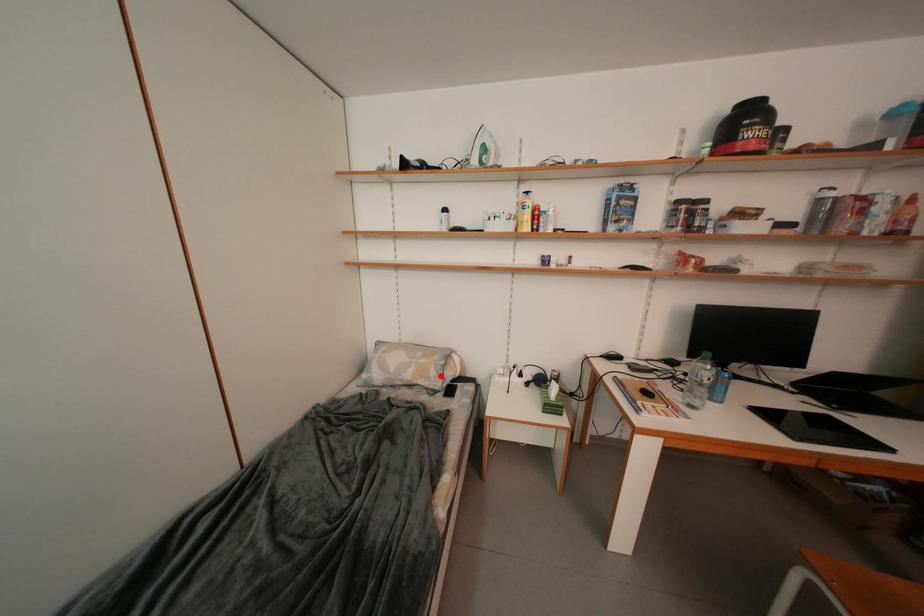
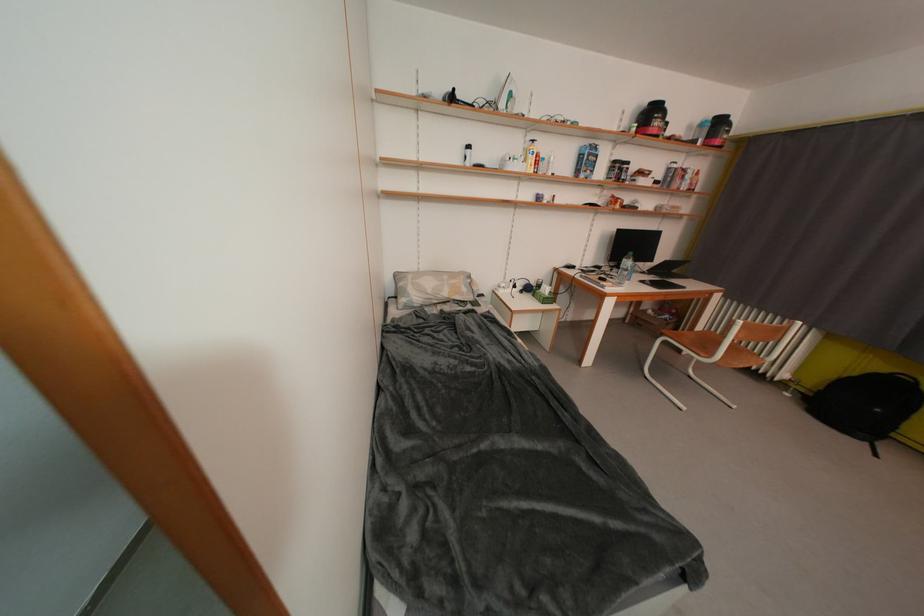
Locate, in the second image, the point that corresponds to the highlighted location in the first image.

(471, 293)